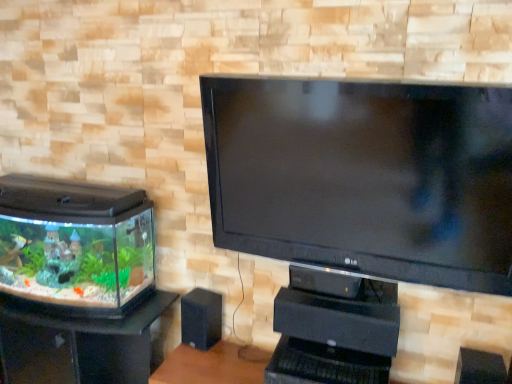
Question: From the image's perspective, is clear glass aquarium at left beneath black matte speaker at lower center?

Choices:
 (A) yes
 (B) no

Answer: (A)

Question: From the image's perspective, is clear glass aquarium at left above black matte speaker at lower center?

Choices:
 (A) no
 (B) yes

Answer: (A)

Question: Can you confirm if clear glass aquarium at left is taller than black matte speaker at lower center?

Choices:
 (A) yes
 (B) no

Answer: (A)

Question: Is clear glass aquarium at left outside of black matte speaker at lower center?

Choices:
 (A) no
 (B) yes

Answer: (B)

Question: Is black matte speaker at lower center at the back of clear glass aquarium at left?

Choices:
 (A) yes
 (B) no

Answer: (B)

Question: From a real-world perspective, is clear glass aquarium at left located beneath black matte speaker at lower center?

Choices:
 (A) no
 (B) yes

Answer: (B)

Question: Can you confirm if black matte speaker at lower center is wider than clear glass aquarium at left?

Choices:
 (A) yes
 (B) no

Answer: (B)

Question: Is black matte speaker at lower center shorter than clear glass aquarium at left?

Choices:
 (A) no
 (B) yes

Answer: (B)

Question: Does black matte speaker at lower center have a larger size compared to clear glass aquarium at left?

Choices:
 (A) no
 (B) yes

Answer: (A)

Question: Is black matte speaker at lower center positioned behind clear glass aquarium at left?

Choices:
 (A) yes
 (B) no

Answer: (A)

Question: Is black matte speaker at lower center aimed at clear glass aquarium at left?

Choices:
 (A) yes
 (B) no

Answer: (B)

Question: Does black matte speaker at lower center have a lesser width compared to clear glass aquarium at left?

Choices:
 (A) yes
 (B) no

Answer: (A)

Question: Considering the positions of clear glass aquarium at left and black matte speaker at lower center in the image, is clear glass aquarium at left taller or shorter than black matte speaker at lower center?

Choices:
 (A) short
 (B) tall

Answer: (B)